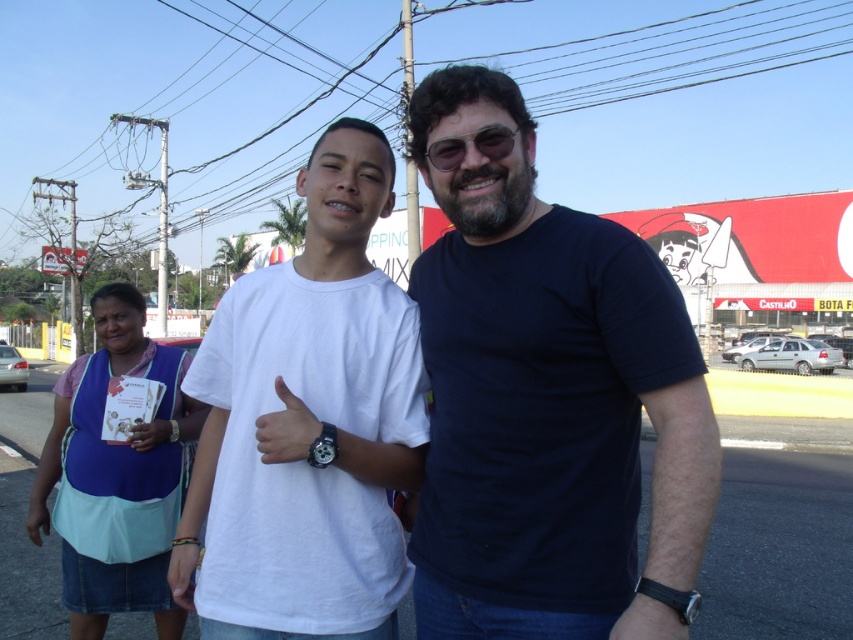
Does point (154, 472) lie in front of point (482, 154)?

No, it is behind (482, 154).

Where is `blue fabric purse at lower left`? This screenshot has height=640, width=853. blue fabric purse at lower left is located at coordinates (115, 474).

Is the position of blue fabric purse at lower left more distant than that of black leather watch at lower right?

That is True.

Between blue fabric purse at lower left and black leather watch at lower right, which one appears on the right side from the viewer's perspective?

From the viewer's perspective, black leather watch at lower right appears more on the right side.

Find the location of a particular element. This screenshot has height=640, width=853. blue fabric purse at lower left is located at coordinates (115, 474).

Does point (233, 344) come behind point (619, 621)?

Yes, point (233, 344) is behind point (619, 621).

Can you confirm if white matte t-shirt at center is positioned above black leather watch at lower right?

Yes.

Is point (184, 545) closer to viewer compared to point (646, 625)?

No, (184, 545) is behind (646, 625).

Where is `white matte t-shirt at center`? white matte t-shirt at center is located at coordinates (316, 417).